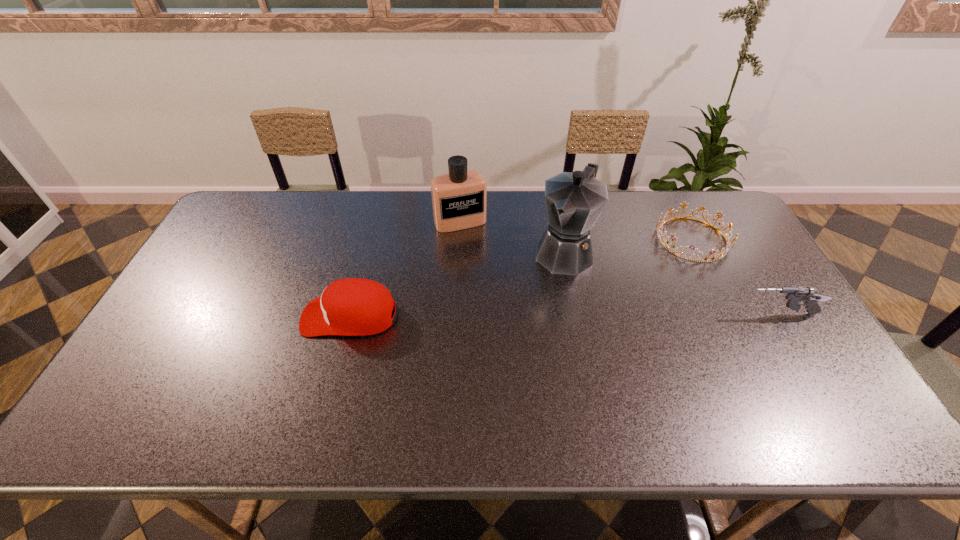
The width and height of the screenshot is (960, 540). I want to click on vacant space situated 0.090m at the barrel of the gun, so click(x=707, y=315).

The height and width of the screenshot is (540, 960). Find the location of `vacant space located at the barrel of the gun`. vacant space located at the barrel of the gun is located at coordinates (608, 315).

You are a GUI agent. You are given a task and a screenshot of the screen. Output one action in this format:
    pyautogui.click(x=<x>, y=<y>)
    Task: Click on the free location located at the barrel of the gun
    The height and width of the screenshot is (540, 960).
    Given the screenshot: What is the action you would take?
    pyautogui.click(x=604, y=315)

You are a GUI agent. You are given a task and a screenshot of the screen. Output one action in this format:
    pyautogui.click(x=<x>, y=<y>)
    Task: Click on the blank space located on the front-facing side of the shortest object
    The image size is (960, 540).
    Given the screenshot: What is the action you would take?
    pyautogui.click(x=630, y=274)

The image size is (960, 540). I want to click on vacant space located 0.350m on the front-facing side of the shortest object, so click(x=585, y=299).

At what (x,y) coordinates should I click in order to perform the action: click on vacant space located on the front-facing side of the shortest object. Please return your answer as a coordinate pair (x, y). The width and height of the screenshot is (960, 540). Looking at the image, I should click on (613, 284).

Locate an element on the screen. Image resolution: width=960 pixels, height=540 pixels. vacant space situated on the front label of the second object from left to right is located at coordinates (492, 286).

Where is `vacant space located 0.150m on the front label of the second object from left to right`? The width and height of the screenshot is (960, 540). vacant space located 0.150m on the front label of the second object from left to right is located at coordinates (481, 263).

I want to click on free point located on the front label of the second object from left to right, so click(498, 301).

Locate an element on the screen. The height and width of the screenshot is (540, 960). vacant space situated 0.200m at the spout of the tallest object is located at coordinates (523, 320).